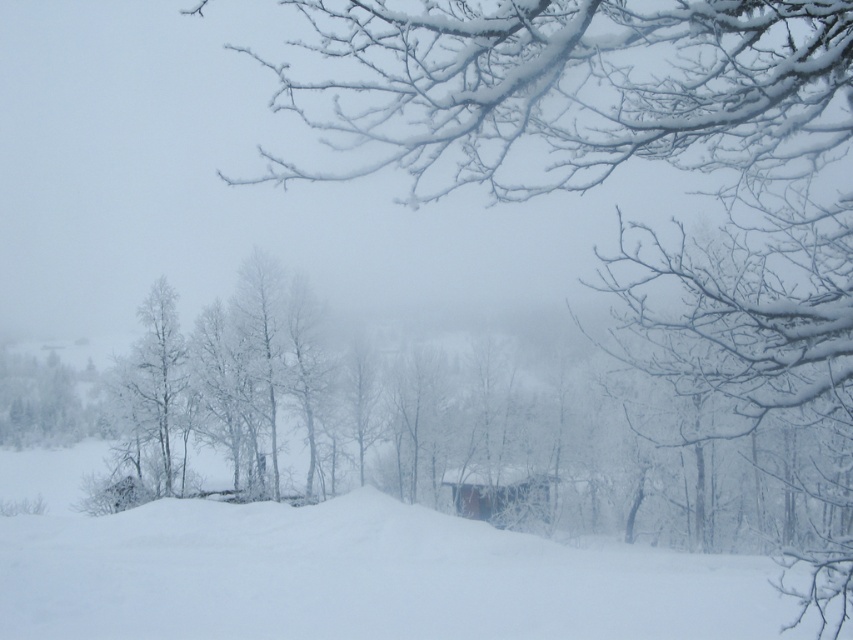
Does green matte tree at left appear on the right side of wooden cabin at center?

No, green matte tree at left is not to the right of wooden cabin at center.

Does green matte tree at left have a smaller size compared to wooden cabin at center?

No, green matte tree at left is not smaller than wooden cabin at center.

Where is `green matte tree at left`? The width and height of the screenshot is (853, 640). green matte tree at left is located at coordinates (39, 401).